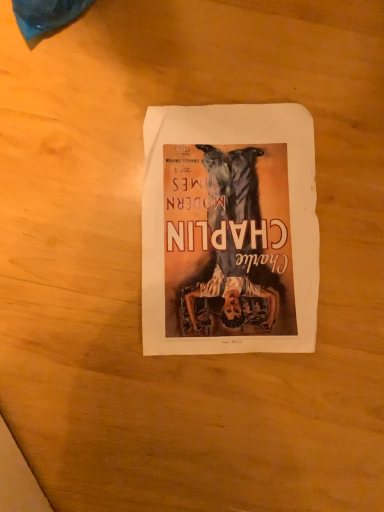
I want to click on free space above matte paper poster at center (from a real-world perspective), so tap(234, 218).